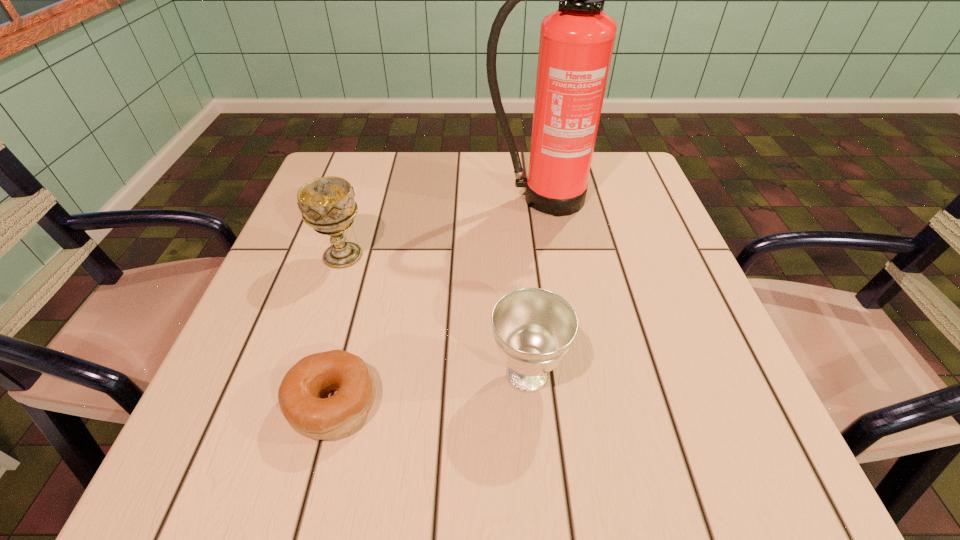
Find the location of a particular element. Image resolution: width=960 pixels, height=540 pixels. the tallest object is located at coordinates (576, 44).

Locate an element on the screen. The width and height of the screenshot is (960, 540). the farthest object is located at coordinates (576, 44).

I want to click on the left chalice, so click(x=327, y=204).

Where is `the second farthest object`? The width and height of the screenshot is (960, 540). the second farthest object is located at coordinates (327, 204).

You are a GUI agent. You are given a task and a screenshot of the screen. Output one action in this format:
    pyautogui.click(x=<x>, y=<y>)
    Task: Click on the right chalice
    This screenshot has width=960, height=540.
    Given the screenshot: What is the action you would take?
    pyautogui.click(x=534, y=328)

This screenshot has width=960, height=540. Identify the location of the shortest object. (300, 394).

At what (x,y) coordinates should I click in order to perform the action: click on vacant space located at the nozzle of the fire extinguisher. Please return your answer as a coordinate pair (x, y). The height and width of the screenshot is (540, 960). Looking at the image, I should click on (564, 341).

Locate an element on the screen. The image size is (960, 540). free space located on the front of the left chalice is located at coordinates (314, 342).

You are a GUI agent. You are given a task and a screenshot of the screen. Output one action in this format:
    pyautogui.click(x=<x>, y=<y>)
    Task: Click on the free space located on the back of the right chalice
    
    Given the screenshot: What is the action you would take?
    pyautogui.click(x=521, y=308)

Identify the location of blank area located on the right of the bagel. Image resolution: width=960 pixels, height=540 pixels. (619, 402).